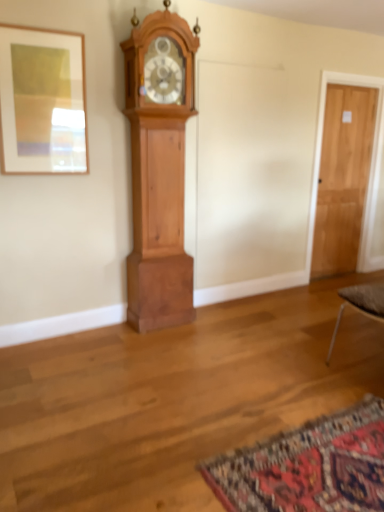
Question: Is matte wood picture frame at upper left further to the viewer compared to cherry wood grandfather clock at left?

Choices:
 (A) no
 (B) yes

Answer: (A)

Question: Is matte wood picture frame at upper left shorter than cherry wood grandfather clock at left?

Choices:
 (A) yes
 (B) no

Answer: (A)

Question: Is matte wood picture frame at upper left not near cherry wood grandfather clock at left?

Choices:
 (A) no
 (B) yes

Answer: (A)

Question: From the image's perspective, would you say matte wood picture frame at upper left is positioned over cherry wood grandfather clock at left?

Choices:
 (A) no
 (B) yes

Answer: (B)

Question: Considering the relative sizes of matte wood picture frame at upper left and cherry wood grandfather clock at left in the image provided, is matte wood picture frame at upper left taller than cherry wood grandfather clock at left?

Choices:
 (A) yes
 (B) no

Answer: (B)

Question: Does matte wood picture frame at upper left have a lesser width compared to cherry wood grandfather clock at left?

Choices:
 (A) no
 (B) yes

Answer: (B)

Question: Considering the relative sizes of matte wood picture frame at upper left and carpeted mat at lower right in the image provided, is matte wood picture frame at upper left bigger than carpeted mat at lower right?

Choices:
 (A) yes
 (B) no

Answer: (B)

Question: Considering the relative positions of matte wood picture frame at upper left and carpeted mat at lower right in the image provided, is matte wood picture frame at upper left to the right of carpeted mat at lower right from the viewer's perspective?

Choices:
 (A) yes
 (B) no

Answer: (B)

Question: From the image's perspective, is matte wood picture frame at upper left located above carpeted mat at lower right?

Choices:
 (A) yes
 (B) no

Answer: (A)

Question: Is there a large distance between matte wood picture frame at upper left and carpeted mat at lower right?

Choices:
 (A) yes
 (B) no

Answer: (A)

Question: Is matte wood picture frame at upper left closer to camera compared to carpeted mat at lower right?

Choices:
 (A) yes
 (B) no

Answer: (B)

Question: Does matte wood picture frame at upper left have a greater width compared to carpeted mat at lower right?

Choices:
 (A) yes
 (B) no

Answer: (B)

Question: Is cherry wood grandfather clock at left not near matte wood picture frame at upper left?

Choices:
 (A) yes
 (B) no

Answer: (B)